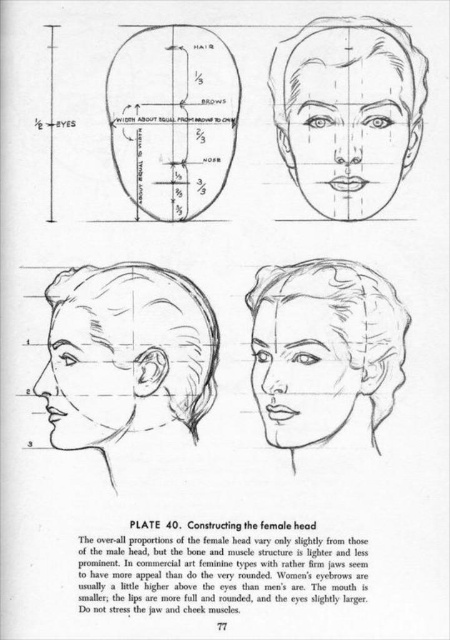
You are an art student trying to replicate the head diagram from Plate 40. You need to position the matte black ear at lower left relative to the smooth skin head at lower left. Based on the diagram, which object should be placed in front?

The smooth skin head at lower left should be placed in front of the matte black ear at lower left because the matte black ear at lower left is behind the smooth skin head at lower left.

You are an art student who needs to compare the size of the smooth skin head at lower left and the smooth skin face at center in the diagram. Which one is larger?

The smooth skin head at lower left is bigger than the smooth skin face at center according to the diagram.

Based on the illustration from Plate 40, which depicts the construction of the female head, you are an art student trying to determine the correct proportions. You notice two depictions of the head and face. The first is the smooth skin head at lower left, and the second is the smooth skin face at upper center. Which of these two has a greater width according to the diagram?

The smooth skin head at lower left has a greater width than the smooth skin face at upper center, as stated in the diagram.